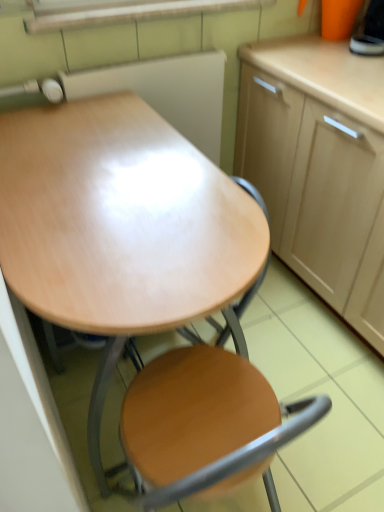
Question: From a real-world perspective, is wooden at center positioned under wooden desk at center based on gravity?

Choices:
 (A) no
 (B) yes

Answer: (B)

Question: Does wooden at center have a greater height compared to wooden desk at center?

Choices:
 (A) no
 (B) yes

Answer: (A)

Question: Is wooden at center at the left side of wooden desk at center?

Choices:
 (A) no
 (B) yes

Answer: (A)

Question: Considering the relative sizes of wooden at center and wooden desk at center in the image provided, is wooden at center shorter than wooden desk at center?

Choices:
 (A) no
 (B) yes

Answer: (B)

Question: Could you tell me if wooden at center is facing wooden desk at center?

Choices:
 (A) yes
 (B) no

Answer: (A)

Question: Considering the relative positions of wooden desk at center and wooden at center in the image provided, is wooden desk at center to the left or to the right of wooden at center?

Choices:
 (A) left
 (B) right

Answer: (A)

Question: From the image's perspective, relative to wooden at center, is wooden desk at center above or below?

Choices:
 (A) below
 (B) above

Answer: (B)

Question: From a real-world perspective, is wooden desk at center above or below wooden at center?

Choices:
 (A) below
 (B) above

Answer: (B)

Question: Is point (96, 477) positioned closer to the camera than point (261, 412)?

Choices:
 (A) farther
 (B) closer

Answer: (A)

Question: Considering the relative positions of light wood cabinet at upper right and wooden desk at center in the image provided, is light wood cabinet at upper right to the left or to the right of wooden desk at center?

Choices:
 (A) left
 (B) right

Answer: (B)

Question: From the image's perspective, relative to wooden desk at center, is light wood cabinet at upper right above or below?

Choices:
 (A) above
 (B) below

Answer: (A)

Question: From a real-world perspective, relative to wooden desk at center, is light wood cabinet at upper right vertically above or below?

Choices:
 (A) below
 (B) above

Answer: (B)

Question: Is light wood cabinet at upper right inside or outside of wooden desk at center?

Choices:
 (A) inside
 (B) outside

Answer: (B)

Question: Considering the positions of wooden at center and wooden desk at center in the image, is wooden at center taller or shorter than wooden desk at center?

Choices:
 (A) tall
 (B) short

Answer: (B)

Question: Would you say wooden at center is inside or outside wooden desk at center?

Choices:
 (A) inside
 (B) outside

Answer: (A)